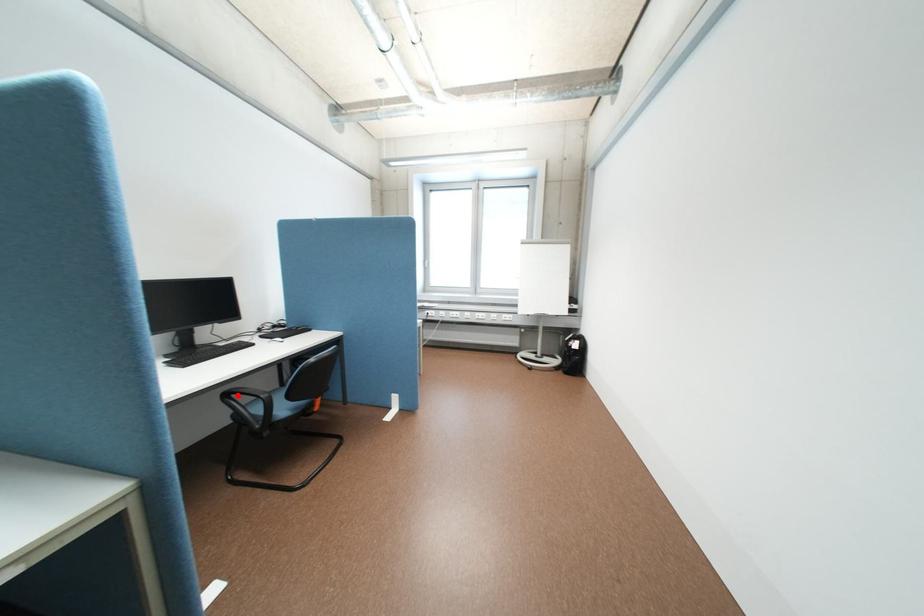
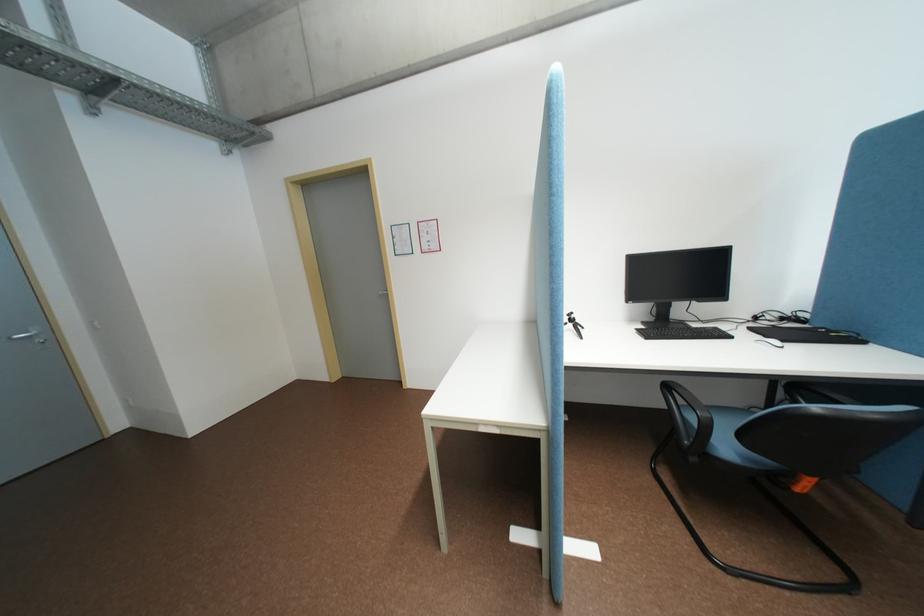
The point at the highlighted location is marked in the first image. Where is the corresponding point in the second image?

(677, 386)